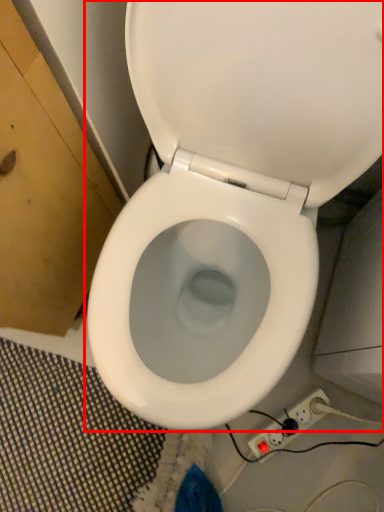
Question: From the image's perspective, where is toilet (annotated by the red box) located in relation to electric outlet in the image?

Choices:
 (A) above
 (B) below

Answer: (A)